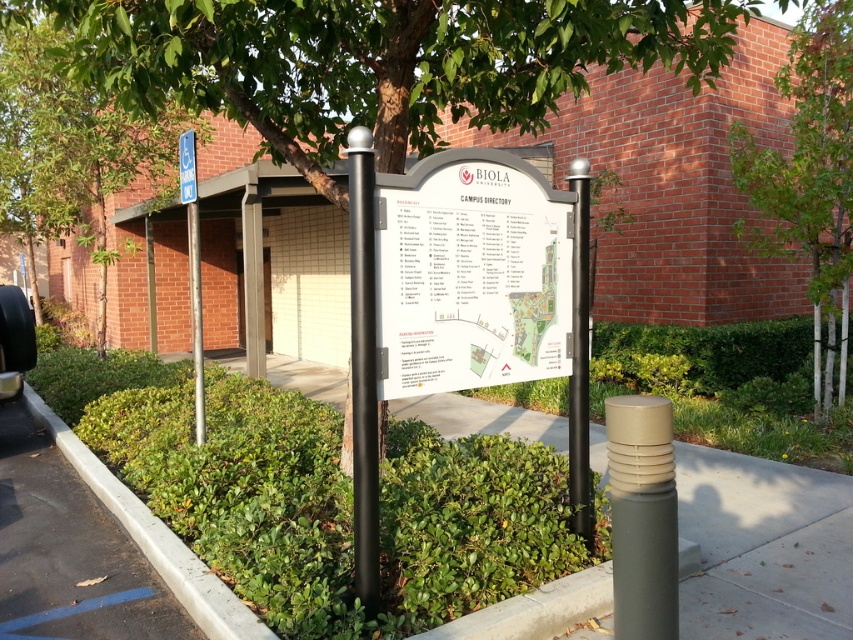
Question: Which point is farther to the camera?

Choices:
 (A) green rubber curb at lower left
 (B) black matte pole at center
 (C) green leafy tree at upper left
 (D) black matte car at lower left

Answer: (D)

Question: Can you confirm if black matte pole at center is wider than black matte car at lower left?

Choices:
 (A) no
 (B) yes

Answer: (A)

Question: Which of the following is the closest to the observer?

Choices:
 (A) (200, 356)
 (B) (198, 586)
 (C) (195, 211)
 (D) (189, 141)

Answer: (B)

Question: Which point is farther from the camera taking this photo?

Choices:
 (A) (843, 324)
 (B) (196, 244)

Answer: (A)

Question: Is black matte pole at center smaller than smooth gray pole at left?

Choices:
 (A) yes
 (B) no

Answer: (A)

Question: Does smooth gray pole at left lie behind blue plastic parking sign at upper left?

Choices:
 (A) yes
 (B) no

Answer: (A)